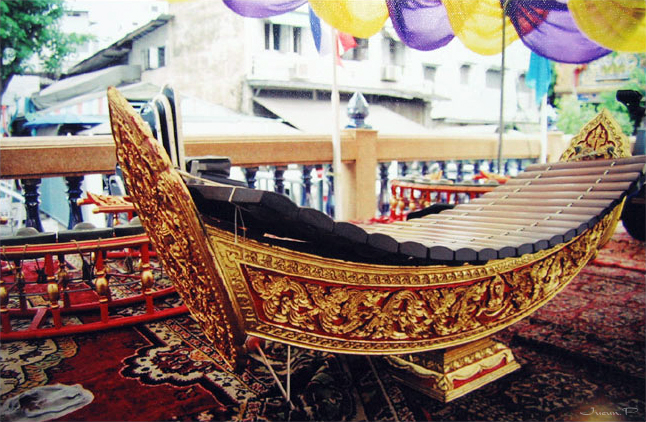
The image size is (646, 422). In order to click on purple fabric in this screenshot , I will do `click(553, 24)`, `click(426, 13)`, `click(271, 11)`.